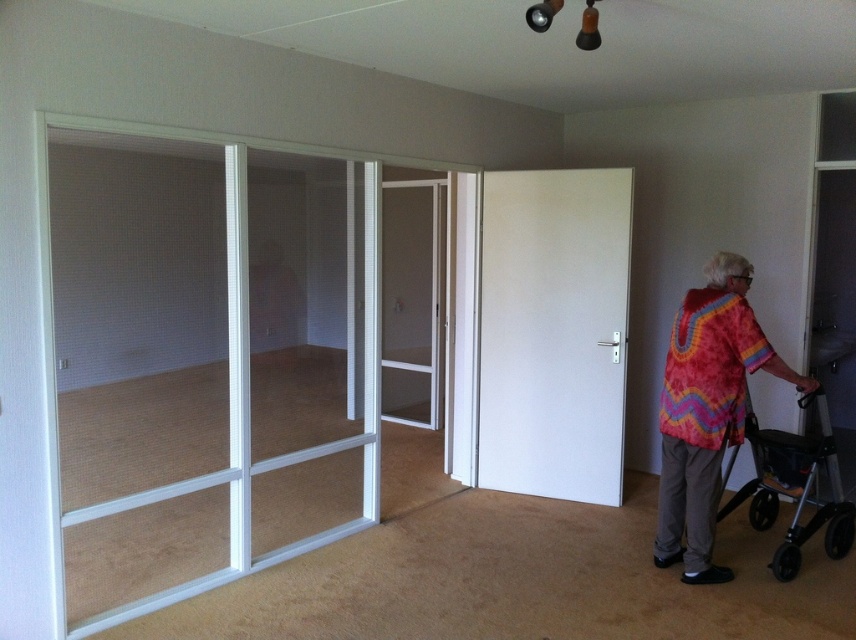
Question: Among these objects, which one is nearest to the camera?

Choices:
 (A) silver metallic walker at lower right
 (B) clear glass door at left
 (C) multicolored knitted sweater at right

Answer: (B)

Question: Can you confirm if clear glass door at left is smaller than white matte door at center?

Choices:
 (A) no
 (B) yes

Answer: (A)

Question: Does multicolored knitted sweater at right have a larger size compared to silver metallic walker at lower right?

Choices:
 (A) yes
 (B) no

Answer: (A)

Question: Among these objects, which one is farthest from the camera?

Choices:
 (A) clear glass door at left
 (B) silver metallic walker at lower right

Answer: (B)

Question: Which point is farther to the camera?

Choices:
 (A) (586, 422)
 (B) (174, 192)

Answer: (A)

Question: Is white matte door at center wider than clear glass screen door at center?

Choices:
 (A) no
 (B) yes

Answer: (B)